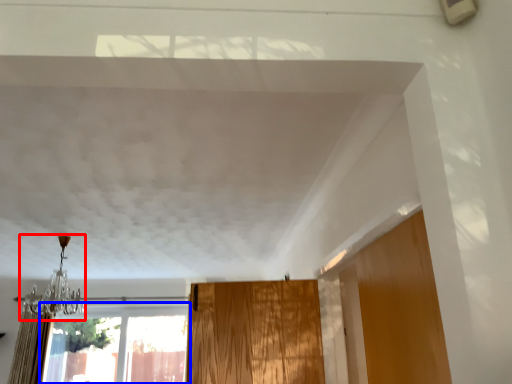
Question: Among these objects, which one is farthest to the camera, light fixture (highlighted by a red box) or window (highlighted by a blue box)?

Choices:
 (A) light fixture
 (B) window

Answer: (B)